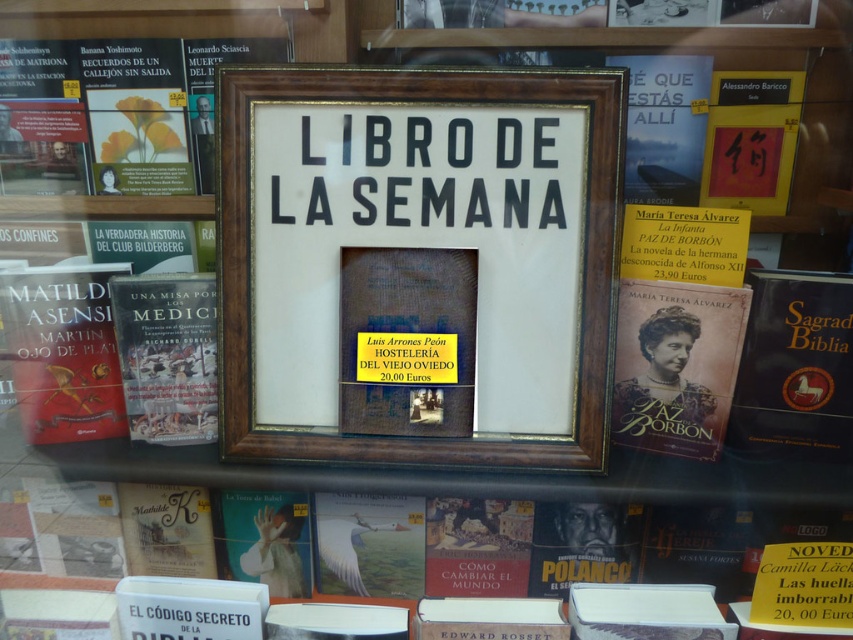
Question: Estimate the real-world distances between objects in this image. Which object is closer to the hardcover book at left?

Choices:
 (A) hardcover book at lower center
 (B) matte gold book at center
 (C) brown leather book at right

Answer: (A)

Question: Which of the following is the farthest from the observer?

Choices:
 (A) (103, 285)
 (B) (720, 532)
 (C) (780, 404)

Answer: (B)

Question: Does matte gold book at center appear over red matte book at upper right?

Choices:
 (A) yes
 (B) no

Answer: (B)

Question: Is hardcover book at lower center bigger than matte red book at left?

Choices:
 (A) yes
 (B) no

Answer: (A)

Question: Which point is closer to the camera?

Choices:
 (A) (734, 161)
 (B) (805, 424)

Answer: (B)

Question: Does hardcover book at lower center appear on the left side of brown leather book at right?

Choices:
 (A) no
 (B) yes

Answer: (B)